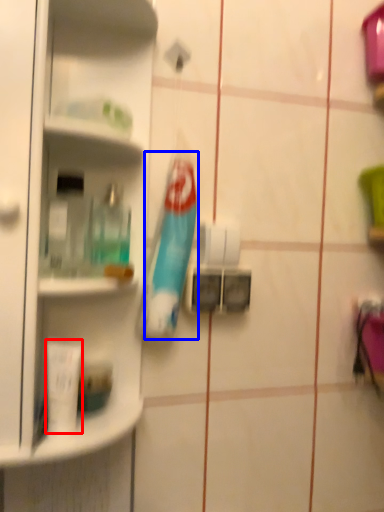
Question: Which of the following is the closest to the observer, toiletry (highlighted by a red box) or toothbrush (highlighted by a blue box)?

Choices:
 (A) toiletry
 (B) toothbrush

Answer: (A)